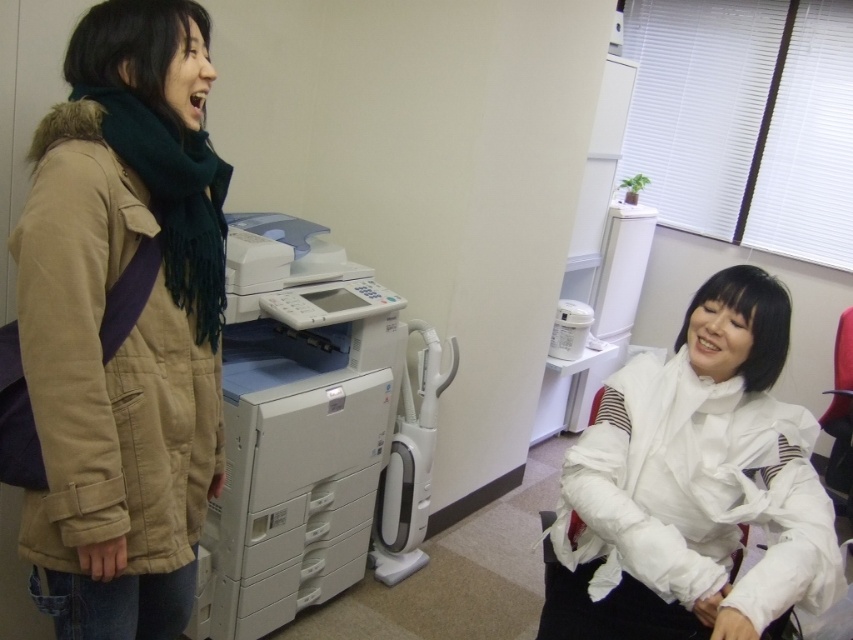
Who is positioned more to the right, white matte printer at left or white plastic vacuum cleaner at center?

white plastic vacuum cleaner at center

Does white matte printer at left come in front of white plastic vacuum cleaner at center?

That is True.

Does point (306, 600) come farther from viewer compared to point (434, 422)?

No, (306, 600) is in front of (434, 422).

The image size is (853, 640). In order to click on white matte printer at left in this screenshot , I will do `click(294, 426)`.

Who is higher up, matte brown jacket at left or white matte printer at left?

matte brown jacket at left is above.

Looking at this image, is matte brown jacket at left to the left of white matte printer at left from the viewer's perspective?

Yes, matte brown jacket at left is to the left of white matte printer at left.

At what (x,y) coordinates should I click in order to perform the action: click on matte brown jacket at left. Please return your answer as a coordinate pair (x, y). Looking at the image, I should click on (x=131, y=330).

This screenshot has width=853, height=640. In order to click on matte brown jacket at left in this screenshot , I will do `click(131, 330)`.

Does point (596, 618) come in front of point (341, 417)?

That is True.

In the scene shown: Is white fabric at center taller than white matte printer at left?

In fact, white fabric at center may be shorter than white matte printer at left.

Where is `white fabric at center`? white fabric at center is located at coordinates (694, 484).

What are the coordinates of `white fabric at center` in the screenshot? It's located at (694, 484).